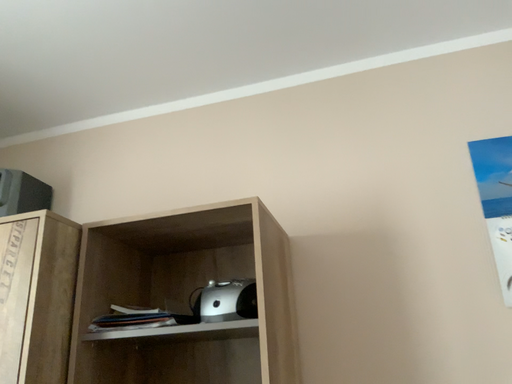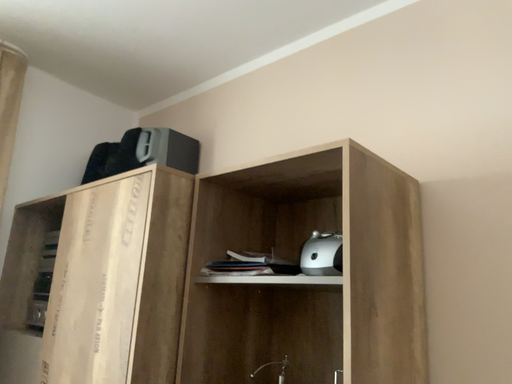
Question: Which way did the camera rotate in the video?

Choices:
 (A) rotated upward
 (B) rotated downward

Answer: (B)